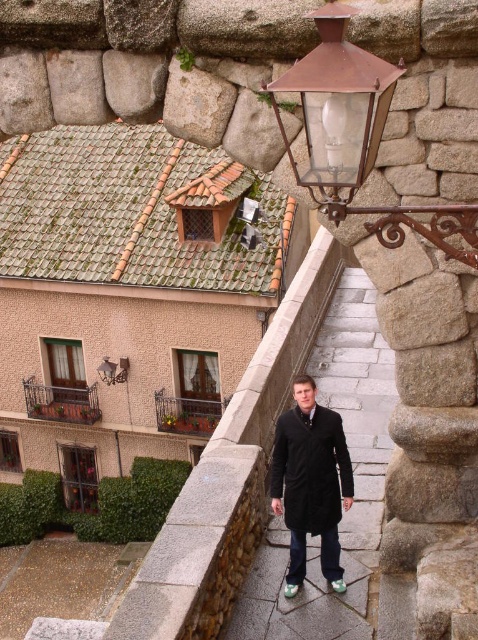
You are standing at the edge of the courtyard and want to reach a specific point marked at coordinates point (391, 241). If your maximum comfortable walking distance is 15 feet, will you be able to comfortably reach that point without straining?

The distance of point (391, 241) from viewer is 16.24 feet, which exceeds your maximum comfortable walking distance of 15 feet. Therefore, reaching that point may require some effort or adjustment.

Looking at this image, you are a photographer standing in the courtyard and want to capture a photo of the black matte coat at center and the rustic wrought iron balcony at center. Which object is positioned higher in the image?

The black matte coat at center is above the rustic wrought iron balcony at center, so it is positioned higher in the image.